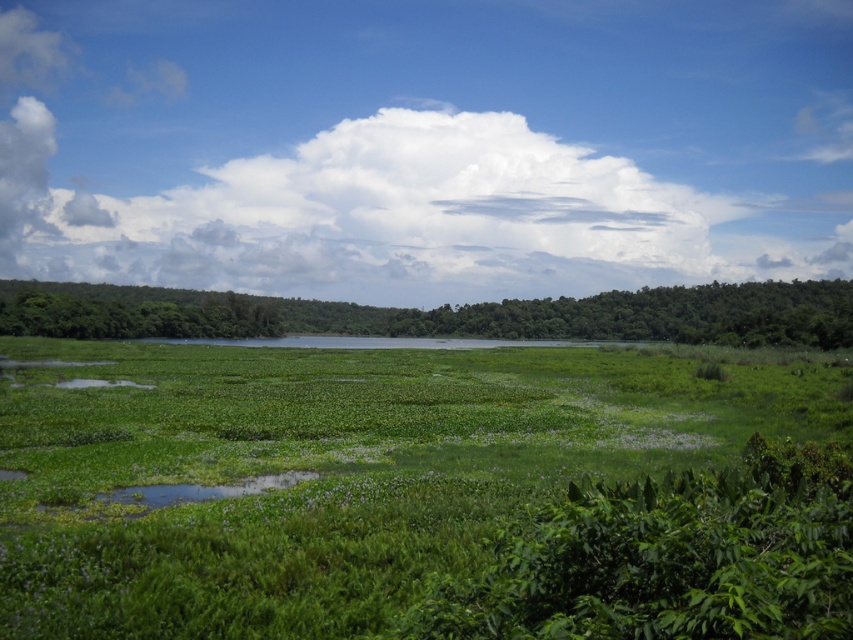
Question: From the image, what is the correct spatial relationship of green leafy grass at center in relation to green leafy tree at center?

Choices:
 (A) below
 (B) above

Answer: (A)

Question: From the image, what is the correct spatial relationship of green leafy grass at center in relation to green leafy tree at center?

Choices:
 (A) below
 (B) above

Answer: (A)

Question: Is green leafy grass at center to the right of green leafy tree at center from the viewer's perspective?

Choices:
 (A) yes
 (B) no

Answer: (B)

Question: Which point appears farthest from the camera in this image?

Choices:
 (A) (479, 369)
 (B) (109, 330)

Answer: (B)

Question: Which of the following is the closest to the observer?

Choices:
 (A) green leafy tree at center
 (B) green leafy grass at center

Answer: (B)